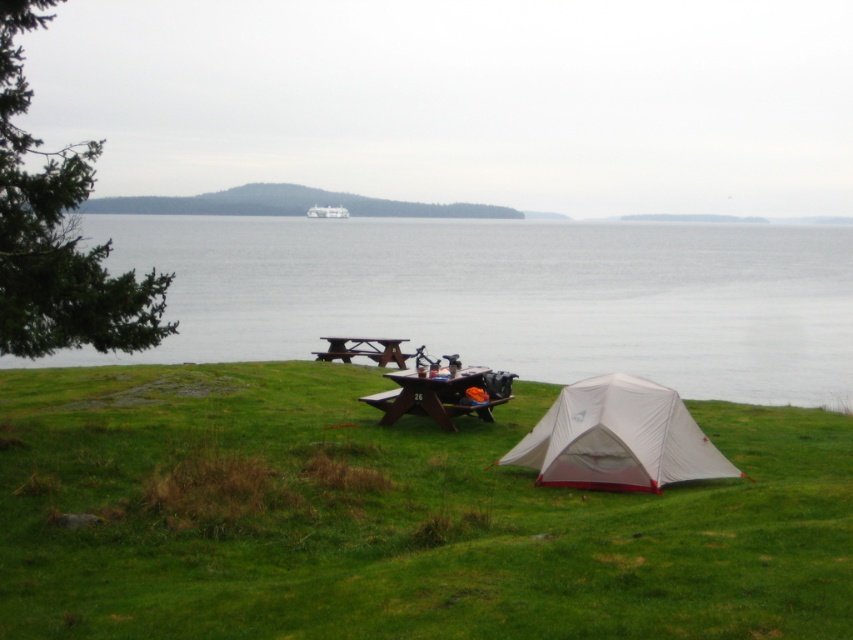
You are planning to set up a tent in the camping area shown. You have a tent that requires a space wider than the brown wooden picnic table at center. Is there enough space on the green grassy at lower center to accommodate it?

The green grassy at lower center has a width larger than the brown wooden picnic table at center, so yes, there is enough space to accommodate the tent requiring a wider space than the picnic table.

You are setting up your tent in the camping scene. You have a map that shows the transparent water at center and the brown wooden picnic table at center. According to the map, which object is positioned to the right of the other?

The transparent water at center is to the right of the brown wooden picnic table at center.